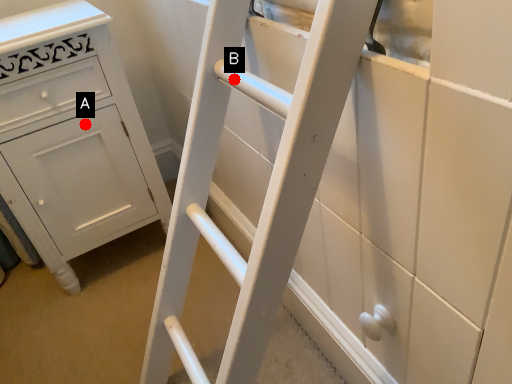
Question: Two points are circled on the image, labeled by A and B beside each circle. Which point is closer to the camera taking this photo?

Choices:
 (A) A is closer
 (B) B is closer

Answer: (B)